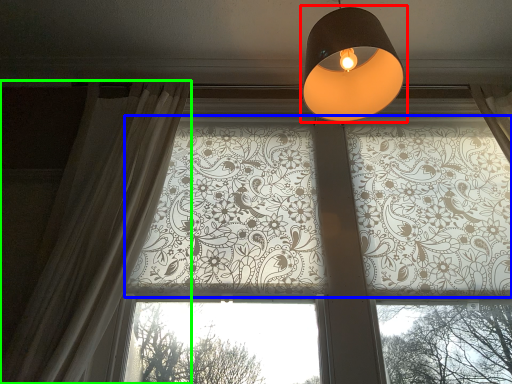
Question: Based on their relative distances, which object is nearer to lamp (highlighted by a red box)? Choose from bay window (highlighted by a blue box) and curtain (highlighted by a green box).

Choices:
 (A) bay window
 (B) curtain

Answer: (A)